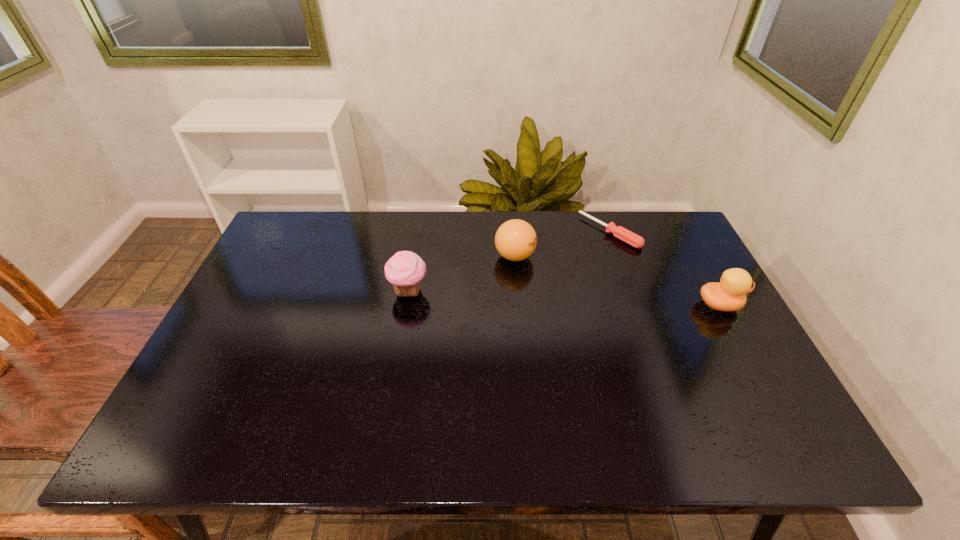
Identify the location of vacant space located 0.080m at the tip of the third object from left to right. [577, 255].

I want to click on vacant space positioned 0.180m at the tip of the third object from left to right, so click(x=557, y=269).

The width and height of the screenshot is (960, 540). What are the coordinates of `ping-pong ball that is at the far edge` in the screenshot? It's located at [515, 240].

Image resolution: width=960 pixels, height=540 pixels. In order to click on screwdriver that is at the far edge in this screenshot , I will do `click(619, 232)`.

Where is `duckling that is at the right edge`? This screenshot has width=960, height=540. duckling that is at the right edge is located at coordinates (730, 294).

Identify the location of screwdriver situated at the right edge. The height and width of the screenshot is (540, 960). (619, 232).

Find the location of a particular element. This screenshot has width=960, height=540. object at the far right corner is located at coordinates (619, 232).

The image size is (960, 540). What are the coordinates of `free space at the far edge` in the screenshot? It's located at (554, 251).

You are a GUI agent. You are given a task and a screenshot of the screen. Output one action in this format:
    pyautogui.click(x=<x>, y=<y>)
    Task: Click on the free space at the left edge of the desktop
    This screenshot has height=540, width=960.
    Given the screenshot: What is the action you would take?
    pyautogui.click(x=233, y=351)

Locate an element on the screen. free region at the right edge of the desktop is located at coordinates (684, 268).